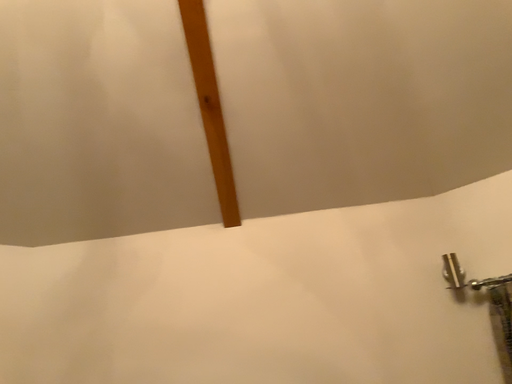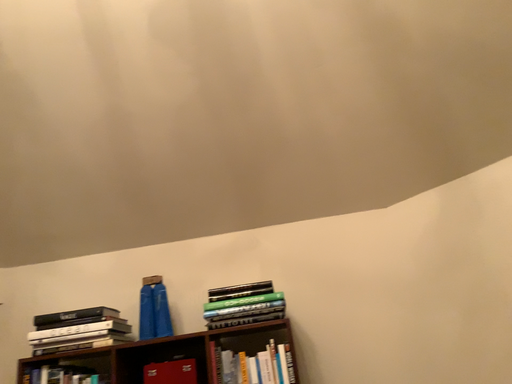
Question: Which way did the camera rotate in the video?

Choices:
 (A) rotated downward
 (B) rotated upward

Answer: (A)